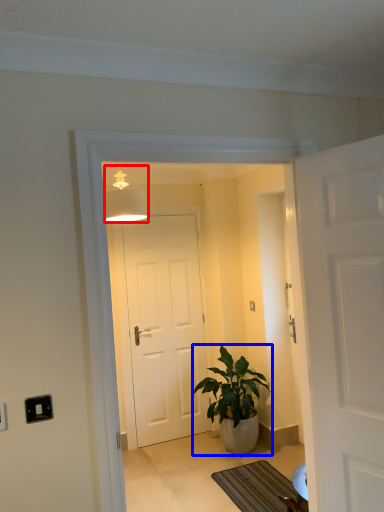
Question: Which object is closer to the camera taking this photo, lamp (highlighted by a red box) or houseplant (highlighted by a blue box)?

Choices:
 (A) lamp
 (B) houseplant

Answer: (A)